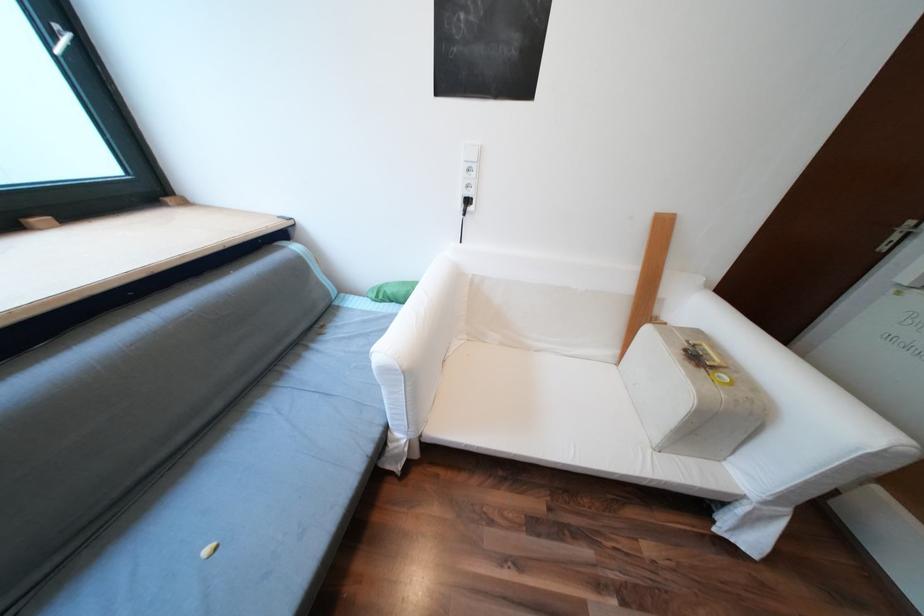
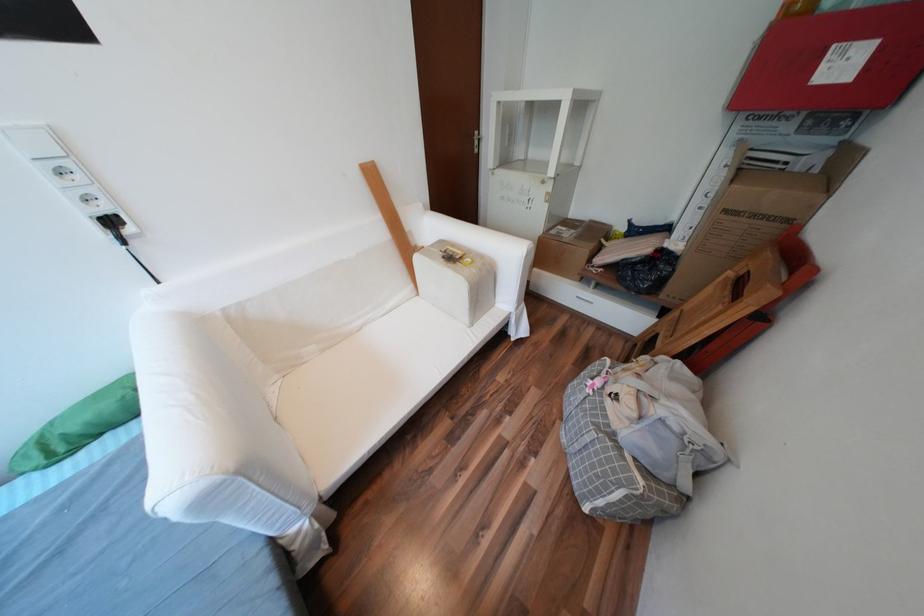
Locate, in the second image, the point that corresponds to (755,496) in the first image.

(519, 313)